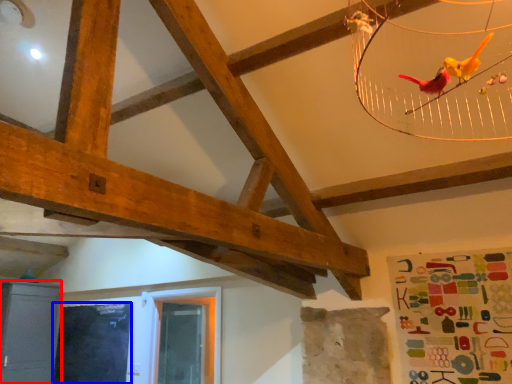
Question: Which of the following is the closest to the observer, furniture (highlighted by a red box) or window screen (highlighted by a blue box)?

Choices:
 (A) furniture
 (B) window screen

Answer: (B)